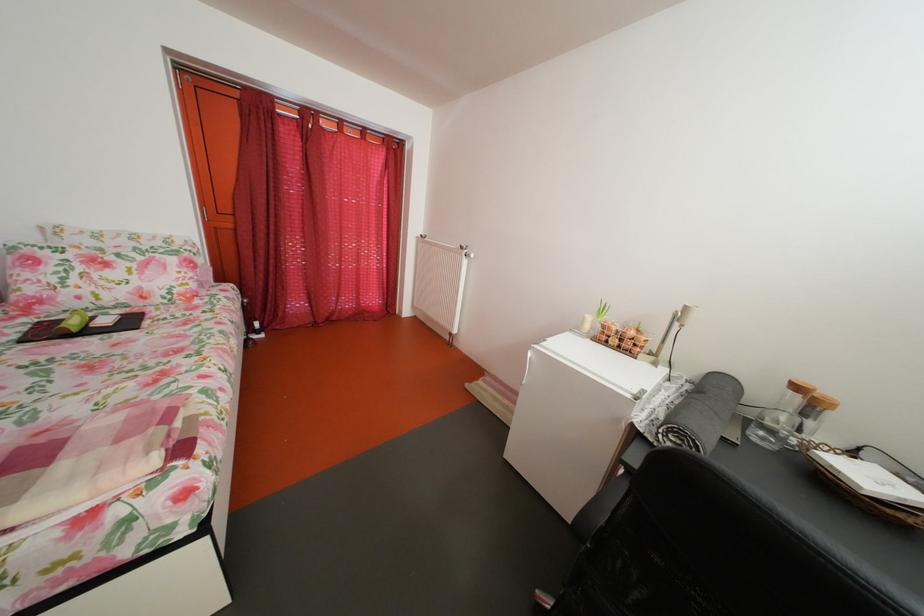
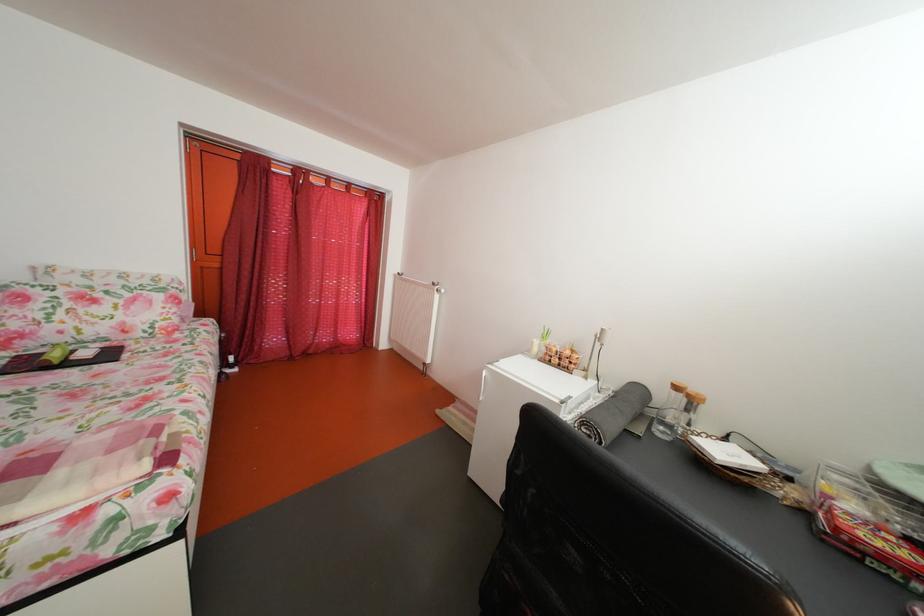
Which direction would the cameraman need to move to produce the second image?

The cameraman moved toward right, backward.